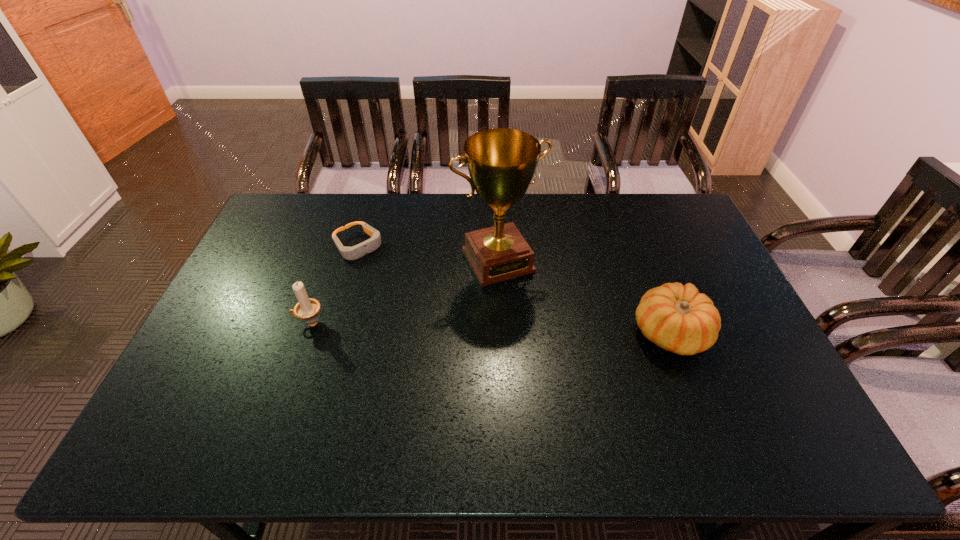
Image resolution: width=960 pixels, height=540 pixels. In order to click on the third shortest object in this screenshot , I will do `click(307, 309)`.

Identify the location of the third tallest object. The image size is (960, 540). (677, 318).

In order to click on gourd in this screenshot , I will do `click(677, 318)`.

Where is `the shortest object`? This screenshot has height=540, width=960. the shortest object is located at coordinates (349, 253).

Locate an element on the screen. award is located at coordinates (501, 162).

Find the location of a particular element. the third object from left to right is located at coordinates (501, 162).

The height and width of the screenshot is (540, 960). I want to click on vacant space located on the handle side of the candle_holder, so click(238, 323).

Locate an element on the screen. The image size is (960, 540). vacant space situated 0.090m on the handle side of the candle_holder is located at coordinates (263, 323).

Find the location of `free location located 0.150m on the handle side of the candle_holder`. free location located 0.150m on the handle side of the candle_holder is located at coordinates (242, 323).

Identify the location of free space located on the left of the rightmost object. This screenshot has width=960, height=540. (515, 333).